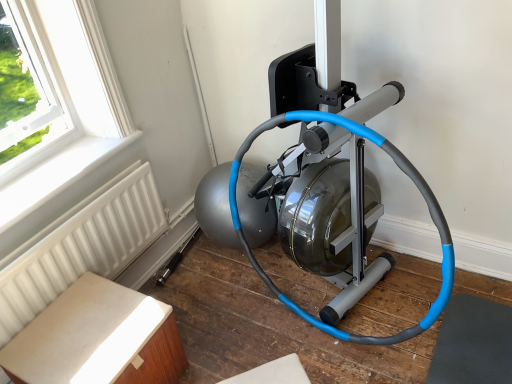
Describe the element at coordinates (97, 339) in the screenshot. I see `light brown wood table at lower left` at that location.

This screenshot has height=384, width=512. What are the coordinates of `white textured radiator at lower left` in the screenshot? It's located at (82, 249).

You are a GUI agent. You are given a task and a screenshot of the screen. Output one action in this format:
    pyautogui.click(x=<x>, y=<y>)
    Task: Click on the white plastic radiator at lower left
    The image size is (512, 384).
    Given the screenshot: What is the action you would take?
    pyautogui.click(x=57, y=175)

Between light brown wood table at lower left and white plastic radiator at lower left, which one has larger width?

Wider between the two is light brown wood table at lower left.

Who is shorter, light brown wood table at lower left or white plastic radiator at lower left?

Standing shorter between the two is white plastic radiator at lower left.

From a real-world perspective, is light brown wood table at lower left positioned above or below white plastic radiator at lower left?

light brown wood table at lower left is below white plastic radiator at lower left.

From the image's perspective, which one is positioned lower, white textured radiator at lower left or blue rubber garden hose at center?

white textured radiator at lower left, from the image's perspective.

From a real-world perspective, which object stands above the other?

In real-world perspective, blue rubber garden hose at center is above.

Which is closer to the camera, (x=127, y=262) or (x=406, y=330)?

Point (x=127, y=262) is positioned farther from the camera compared to point (x=406, y=330).

Would you say blue rubber garden hose at center is part of white textured radiator at lower left's contents?

No, white textured radiator at lower left does not contain blue rubber garden hose at center.

Which object is further away from the camera taking this photo, light brown wood table at lower left or white textured radiator at lower left?

white textured radiator at lower left is further away from the camera.

From the image's perspective, is light brown wood table at lower left located above or below white textured radiator at lower left?

light brown wood table at lower left is below white textured radiator at lower left.

Who is shorter, light brown wood table at lower left or white textured radiator at lower left?

light brown wood table at lower left.

Does point (145, 358) come closer to viewer compared to point (106, 234)?

That is True.

Does white plastic radiator at lower left have a greater width compared to white textured radiator at lower left?

Correct, the width of white plastic radiator at lower left exceeds that of white textured radiator at lower left.

From the image's perspective, is white plastic radiator at lower left located above or below white textured radiator at lower left?

From the image's perspective, white plastic radiator at lower left appears above white textured radiator at lower left.

Is the depth of white plastic radiator at lower left less than that of white textured radiator at lower left?

No, it is not.

Locate an element on the screen. Image resolution: width=512 pixels, height=384 pixels. window sill located on the left of white textured radiator at lower left is located at coordinates (57, 175).

Does point (412, 167) lie in front of point (96, 148)?

Yes, it is.

Could you tell me if blue rubber garden hose at center is turned towards white plastic radiator at lower left?

No, blue rubber garden hose at center does not turn towards white plastic radiator at lower left.

Based on the photo, is blue rubber garden hose at center closer to camera compared to white plastic radiator at lower left?

That is True.

From a real-world perspective, is blue rubber garden hose at center beneath light brown wood table at lower left?

Actually, blue rubber garden hose at center is physically above light brown wood table at lower left in the real world.

From the image's perspective, is blue rubber garden hose at center located above light brown wood table at lower left?

Yes, from the image's perspective, blue rubber garden hose at center is on top of light brown wood table at lower left.

Who is bigger, blue rubber garden hose at center or light brown wood table at lower left?

blue rubber garden hose at center is bigger.

Does white plastic radiator at lower left have a larger size compared to blue rubber garden hose at center?

Incorrect, white plastic radiator at lower left is not larger than blue rubber garden hose at center.

Based on the photo, in the image, is white plastic radiator at lower left positioned in front of or behind blue rubber garden hose at center?

Clearly, white plastic radiator at lower left is behind blue rubber garden hose at center.

Which of these two, white plastic radiator at lower left or blue rubber garden hose at center, is thinner?

blue rubber garden hose at center.

I want to click on furniture located below the white plastic radiator at lower left (from the image's perspective), so click(97, 339).

Locate an element on the screen. The height and width of the screenshot is (384, 512). garden hose that appears in front of the white textured radiator at lower left is located at coordinates (406, 174).

Looking at this image, which object lies further to the anchor point blue rubber garden hose at center, white textured radiator at lower left or light brown wood table at lower left?

The object further to blue rubber garden hose at center is light brown wood table at lower left.

Based on their spatial positions, is white plastic radiator at lower left or white textured radiator at lower left closer to light brown wood table at lower left?

white textured radiator at lower left is positioned closer to the anchor light brown wood table at lower left.

Looking at this image, based on their spatial positions, is light brown wood table at lower left or white textured radiator at lower left further from white plastic radiator at lower left?

Based on the image, light brown wood table at lower left appears to be further to white plastic radiator at lower left.

From the image, which object appears to be farther from blue rubber garden hose at center, light brown wood table at lower left or white plastic radiator at lower left?

white plastic radiator at lower left.

Looking at the image, which one is located closer to white textured radiator at lower left, blue rubber garden hose at center or light brown wood table at lower left?

light brown wood table at lower left.

Estimate the real-world distances between objects in this image. Which object is further from white textured radiator at lower left, blue rubber garden hose at center or white plastic radiator at lower left?

blue rubber garden hose at center.

Based on their spatial positions, is white textured radiator at lower left or white plastic radiator at lower left further from blue rubber garden hose at center?

The object further to blue rubber garden hose at center is white plastic radiator at lower left.

From the picture: Which object lies nearer to the anchor point light brown wood table at lower left, white plastic radiator at lower left or blue rubber garden hose at center?

white plastic radiator at lower left is closer to light brown wood table at lower left.

Where is `furniture located between white textured radiator at lower left and blue rubber garden hose at center in the left-right direction`? furniture located between white textured radiator at lower left and blue rubber garden hose at center in the left-right direction is located at coordinates (97, 339).

Locate an element on the screen. radiator between white plastic radiator at lower left and light brown wood table at lower left from top to bottom is located at coordinates (82, 249).

Where is `furniture situated between white plastic radiator at lower left and blue rubber garden hose at center from left to right`? The height and width of the screenshot is (384, 512). furniture situated between white plastic radiator at lower left and blue rubber garden hose at center from left to right is located at coordinates (97, 339).

Identify the location of radiator situated between white plastic radiator at lower left and blue rubber garden hose at center from left to right. The image size is (512, 384). (82, 249).